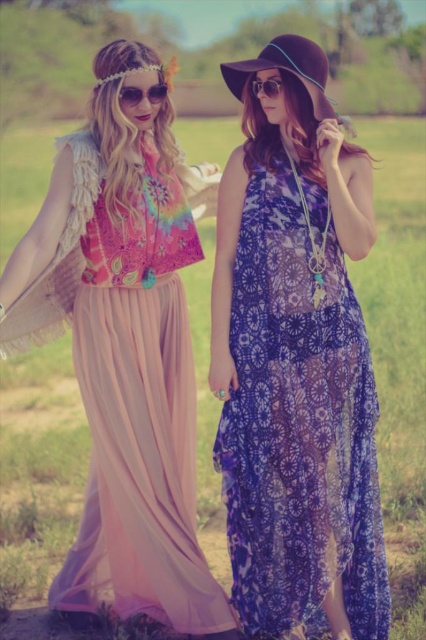
Question: Does purple sheer dress at right appear over sunglasses at center?

Choices:
 (A) yes
 (B) no

Answer: (B)

Question: Estimate the real-world distances between objects in this image. Which object is farther from the velvet purple hat at upper center?

Choices:
 (A) sunglasses at center
 (B) matte black sunglasses at upper center
 (C) purple sheer dress at right

Answer: (C)

Question: Does purple sheer dress at right have a lesser width compared to matte black sunglasses at upper center?

Choices:
 (A) no
 (B) yes

Answer: (A)

Question: Which object is the farthest from the velvet purple hat at upper center?

Choices:
 (A) matte pink chiffon skirt at left
 (B) matte black sunglasses at upper center
 (C) sunglasses at center

Answer: (A)

Question: In this image, where is purple sheer dress at right located relative to sunglasses at center?

Choices:
 (A) above
 (B) below

Answer: (B)

Question: Which point is closer to the camera taking this photo?

Choices:
 (A) (308, 554)
 (B) (25, 284)
 (C) (291, 35)

Answer: (C)